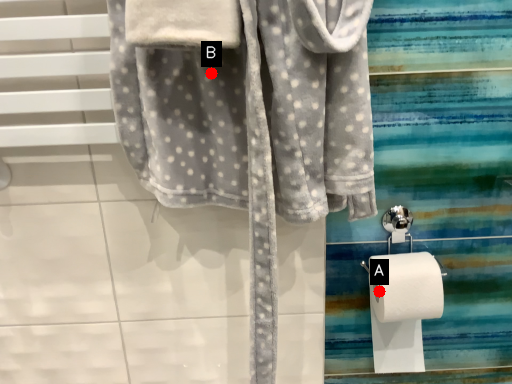
Question: Two points are circled on the image, labeled by A and B beside each circle. Among these points, which one is farthest from the camera?

Choices:
 (A) A is further
 (B) B is further

Answer: (A)